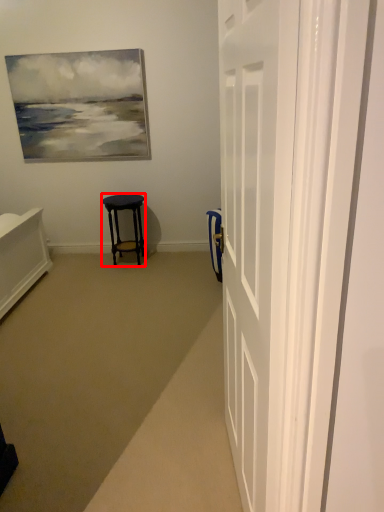
Question: From the image's perspective, where is stool (annotated by the red box) located in relation to door in the image?

Choices:
 (A) below
 (B) above

Answer: (B)